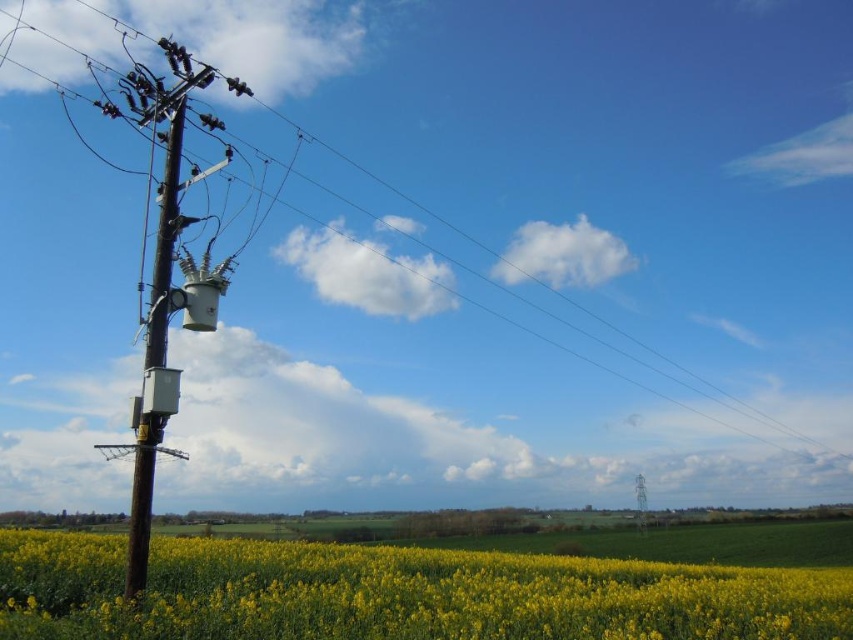
Question: In this image, where is yellow matte flower at lower left located relative to brown wooden telegraph pole at left?

Choices:
 (A) above
 (B) below

Answer: (B)

Question: Considering the relative positions of yellow matte flower at lower left and brown wooden telegraph pole at left in the image provided, where is yellow matte flower at lower left located with respect to brown wooden telegraph pole at left?

Choices:
 (A) below
 (B) above

Answer: (A)

Question: Among these points, which one is nearest to the camera?

Choices:
 (A) (96, 596)
 (B) (154, 305)
 (C) (15, 365)

Answer: (B)

Question: Which object appears farthest from the camera in this image?

Choices:
 (A) brown wooden telegraph pole at left
 (B) brown metallic pole at left

Answer: (A)

Question: Is yellow matte flower at lower left bigger than brown wooden pole at left?

Choices:
 (A) no
 (B) yes

Answer: (B)

Question: Which point is closer to the camera?

Choices:
 (A) (146, 420)
 (B) (256, 554)
 (C) (143, 458)
 (D) (253, 301)

Answer: (C)